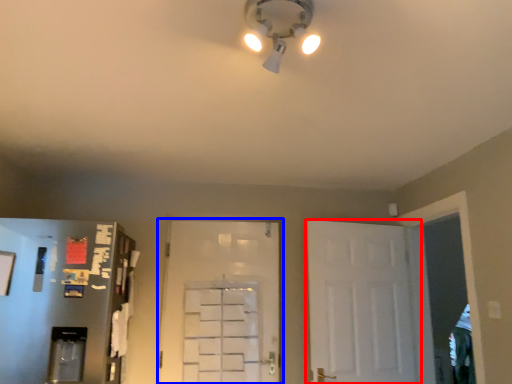
Question: Which point is further to the camera, door (highlighted by a red box) or door (highlighted by a blue box)?

Choices:
 (A) door
 (B) door

Answer: (B)